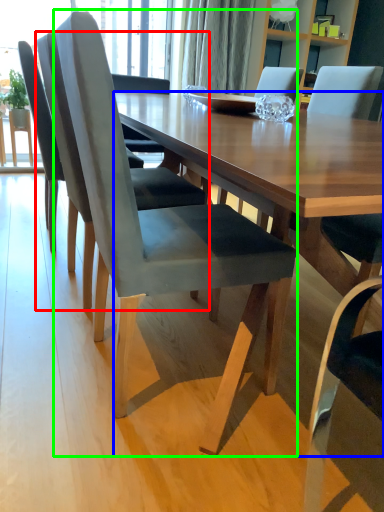
Question: Based on their relative distances, which object is farther from chair (highlighted by a red box)? Choose from desk (highlighted by a blue box) and chair (highlighted by a green box).

Choices:
 (A) desk
 (B) chair

Answer: (A)